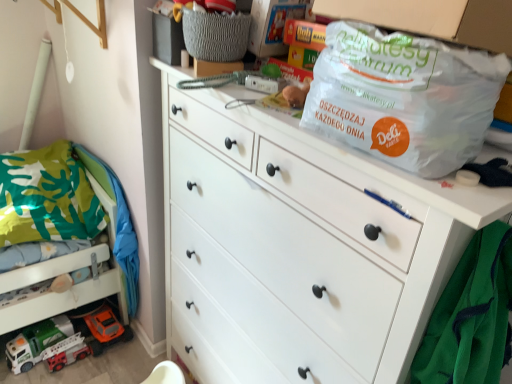
The height and width of the screenshot is (384, 512). I want to click on free spot above gray woven basket at upper center (from a real-world perspective), so pos(215,8).